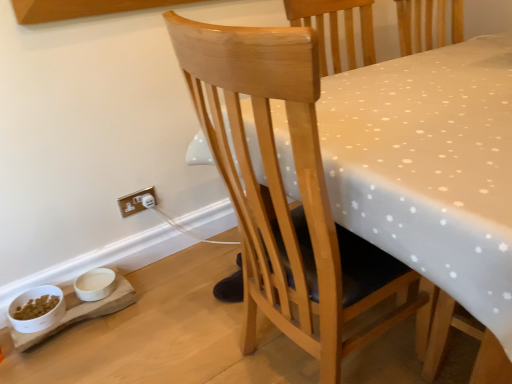
Question: Does point (136, 210) appear closer or farther from the camera than point (40, 316)?

Choices:
 (A) farther
 (B) closer

Answer: (A)

Question: In terms of height, does gold metallic electrical outlet at lower left look taller or shorter compared to white glossy bowl at lower left, which appears as the 1th bowl when viewed from the left?

Choices:
 (A) tall
 (B) short

Answer: (A)

Question: Which object is the farthest from the white glossy bowl at lower left, which appears as the 1th bowl when viewed from the left?

Choices:
 (A) natural wood chair at center
 (B) gold metallic electrical outlet at lower left
 (C) white matte bowl at lower left, the second bowl viewed from the left

Answer: (A)

Question: Estimate the real-world distances between objects in this image. Which object is closer to the white glossy bowl at lower left, which appears as the 1th bowl when viewed from the left?

Choices:
 (A) gold metallic electrical outlet at lower left
 (B) white matte bowl at lower left, the second bowl viewed from the left
 (C) natural wood chair at center

Answer: (B)